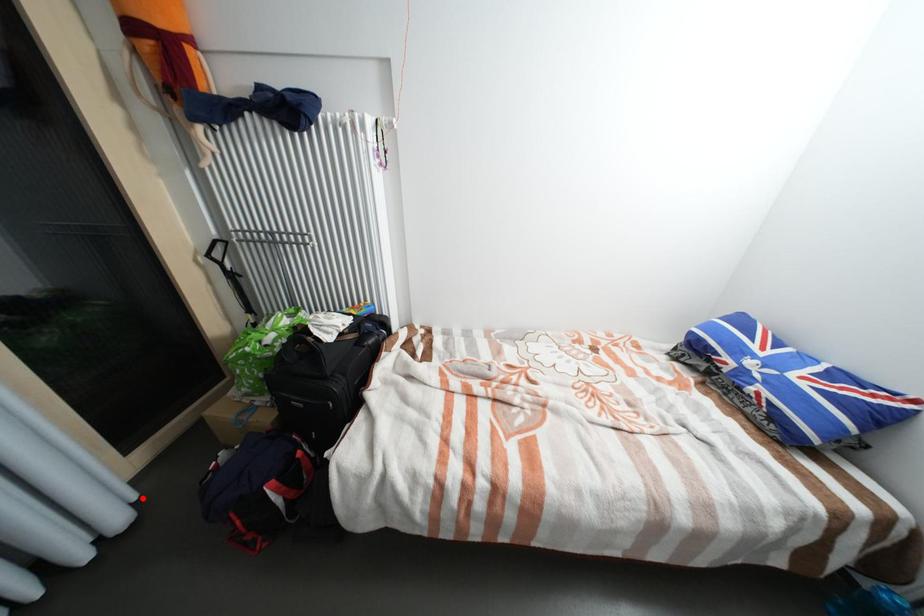
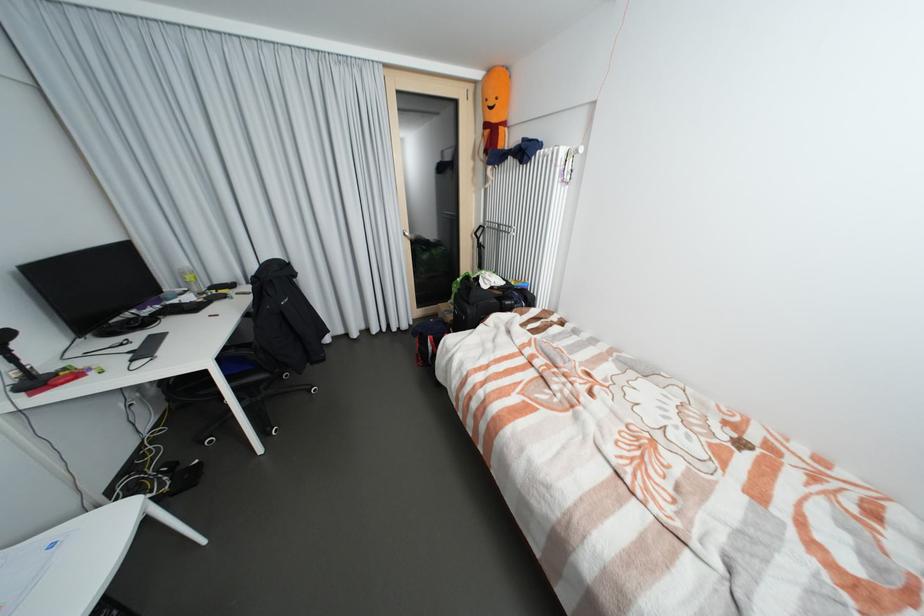
Question: I am providing you with two images of the same scene from different viewpoints. Given a red point in image1, look at the same physical point in image2. Is it:

Choices:
 (A) Closer to the viewpoint
 (B) Farther from the viewpoint

Answer: (B)